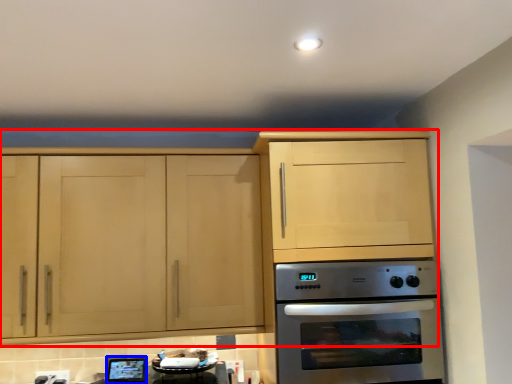
Question: Which point is closer to the camera, cabinetry (highlighted by a red box) or appliance (highlighted by a blue box)?

Choices:
 (A) cabinetry
 (B) appliance

Answer: (A)